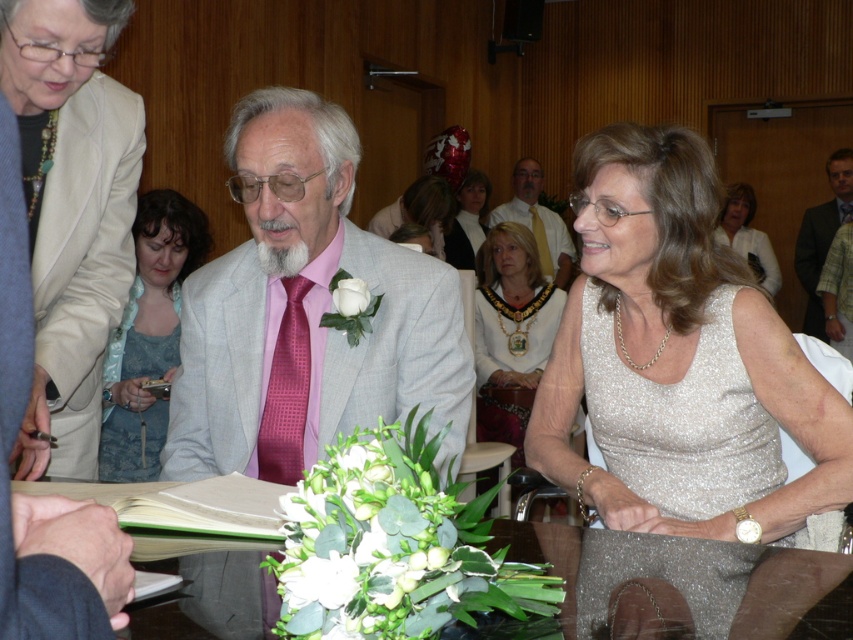
Is shiny brown table at center wider than white satin dress at center?

Yes.

Is shiny brown table at center to the left of white satin dress at center from the viewer's perspective?

Incorrect, shiny brown table at center is not on the left side of white satin dress at center.

Measure the distance between point (631, 586) and camera.

Point (631, 586) and camera are 3.80 feet apart.

The image size is (853, 640). I want to click on shiny brown table at center, so tap(686, 582).

Is shiny brown table at center in front of shiny purple tie at center?

Yes.

Is shiny brown table at center smaller than shiny purple tie at center?

No, shiny brown table at center is not smaller than shiny purple tie at center.

Which is behind, point (758, 595) or point (846, 202)?

Point (846, 202)

Image resolution: width=853 pixels, height=640 pixels. In order to click on shiny brown table at center in this screenshot , I will do `click(686, 582)`.

Can you confirm if beige satin jacket at upper left is wider than shiny purple tie at center?

Yes.

Consider the image. Does beige satin jacket at upper left appear under shiny purple tie at center?

Indeed, beige satin jacket at upper left is positioned under shiny purple tie at center.

What are the coordinates of `beige satin jacket at upper left` in the screenshot? It's located at (71, 211).

What are the coordinates of `beige satin jacket at upper left` in the screenshot? It's located at (71, 211).